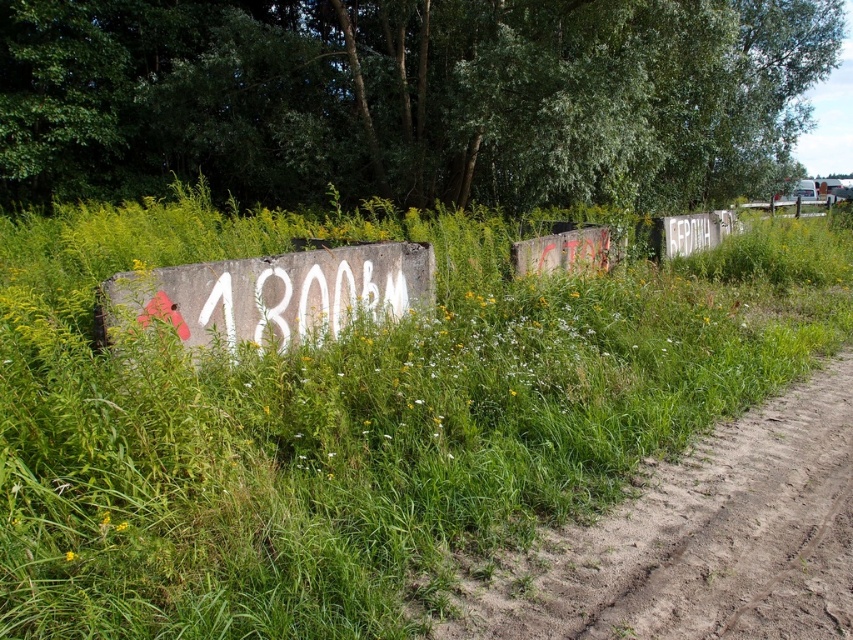
Does white painted concrete sign at center have a smaller size compared to white painted graffiti at center?

Actually, white painted concrete sign at center might be larger than white painted graffiti at center.

Is point (247, 288) closer to viewer compared to point (369, 301)?

Yes, point (247, 288) is closer to viewer.

Is point (334, 278) less distant than point (225, 307)?

No, it is behind (225, 307).

You are a GUI agent. You are given a task and a screenshot of the screen. Output one action in this format:
    pyautogui.click(x=<x>, y=<y>)
    Task: Click on the white painted concrete sign at center
    This screenshot has width=853, height=640.
    Given the screenshot: What is the action you would take?
    pyautogui.click(x=273, y=292)

Does green grass at center have a lesser height compared to brown sandy dirt track at lower right?

No, green grass at center is not shorter than brown sandy dirt track at lower right.

Is green grass at center positioned in front of brown sandy dirt track at lower right?

Yes, green grass at center is in front of brown sandy dirt track at lower right.

What do you see at coordinates (355, 417) in the screenshot? I see `green grass at center` at bounding box center [355, 417].

You are a GUI agent. You are given a task and a screenshot of the screen. Output one action in this format:
    pyautogui.click(x=<x>, y=<y>)
    Task: Click on the green grass at center
    
    Given the screenshot: What is the action you would take?
    pyautogui.click(x=355, y=417)

Does green grass at center appear under white painted graffiti at center?

No.

Between green grass at center and white painted graffiti at center, which one is positioned lower?

white painted graffiti at center is lower down.

Who is more distant from viewer, [74,424] or [254,321]?

Positioned behind is point [254,321].

Where is `green grass at center`? green grass at center is located at coordinates (355, 417).